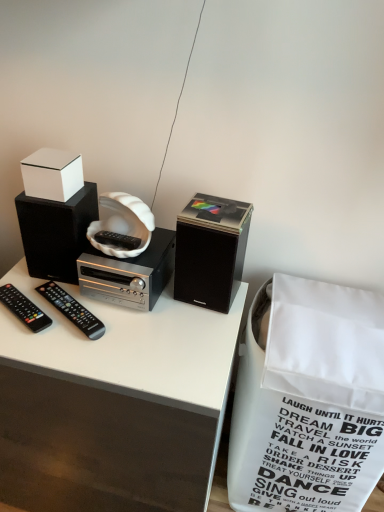
Question: Can you confirm if white glossy box at upper left is smaller than black plastic remote at lower left, the 1th remote control viewed from the right?

Choices:
 (A) no
 (B) yes

Answer: (A)

Question: Is white glossy box at upper left located outside black plastic remote at lower left, the 1th remote control viewed from the right?

Choices:
 (A) yes
 (B) no

Answer: (A)

Question: Is white glossy box at upper left touching black plastic remote at lower left, the 1th remote control viewed from the right?

Choices:
 (A) no
 (B) yes

Answer: (A)

Question: From the image's perspective, does white glossy box at upper left appear lower than black plastic remote at lower left, the 1th remote control viewed from the right?

Choices:
 (A) no
 (B) yes

Answer: (A)

Question: From a real-world perspective, is white glossy box at upper left located higher than black plastic remote at lower left, the 1th remote control viewed from the right?

Choices:
 (A) no
 (B) yes

Answer: (B)

Question: Would you say black plastic remote at left, which ranks as the 1th remote control in left-to-right order, is to the left or to the right of white paper shopping bag at lower right in the picture?

Choices:
 (A) right
 (B) left

Answer: (B)

Question: From the image's perspective, is black plastic remote at left, which ranks as the 1th remote control in left-to-right order, above or below white paper shopping bag at lower right?

Choices:
 (A) below
 (B) above

Answer: (B)

Question: Relative to white paper shopping bag at lower right, is black plastic remote at left, which ranks as the 1th remote control in left-to-right order, in front or behind?

Choices:
 (A) behind
 (B) front

Answer: (A)

Question: Is black plastic remote at left, which ranks as the 1th remote control in left-to-right order, wider or thinner than white paper shopping bag at lower right?

Choices:
 (A) wide
 (B) thin

Answer: (B)

Question: Is point (216, 285) closer or farther from the camera than point (89, 326)?

Choices:
 (A) closer
 (B) farther

Answer: (B)

Question: From the image's perspective, is black matte speaker at center, marked as the first speaker in a right-to-left arrangement, located above or below black plastic remote at lower left, which is counted as the 2th remote control, starting from the left?

Choices:
 (A) above
 (B) below

Answer: (A)

Question: Is black matte speaker at center, which is the 2th speaker from left to right, wider or thinner than black plastic remote at lower left, which is counted as the 2th remote control, starting from the left?

Choices:
 (A) wide
 (B) thin

Answer: (A)

Question: Is black matte speaker at center, marked as the first speaker in a right-to-left arrangement, situated inside black plastic remote at lower left, the 1th remote control viewed from the right, or outside?

Choices:
 (A) outside
 (B) inside

Answer: (A)

Question: Considering their positions, is white matte cassette at center located in front of or behind white paper shopping bag at lower right?

Choices:
 (A) behind
 (B) front

Answer: (A)

Question: Would you say white matte cassette at center is inside or outside white paper shopping bag at lower right?

Choices:
 (A) inside
 (B) outside

Answer: (B)